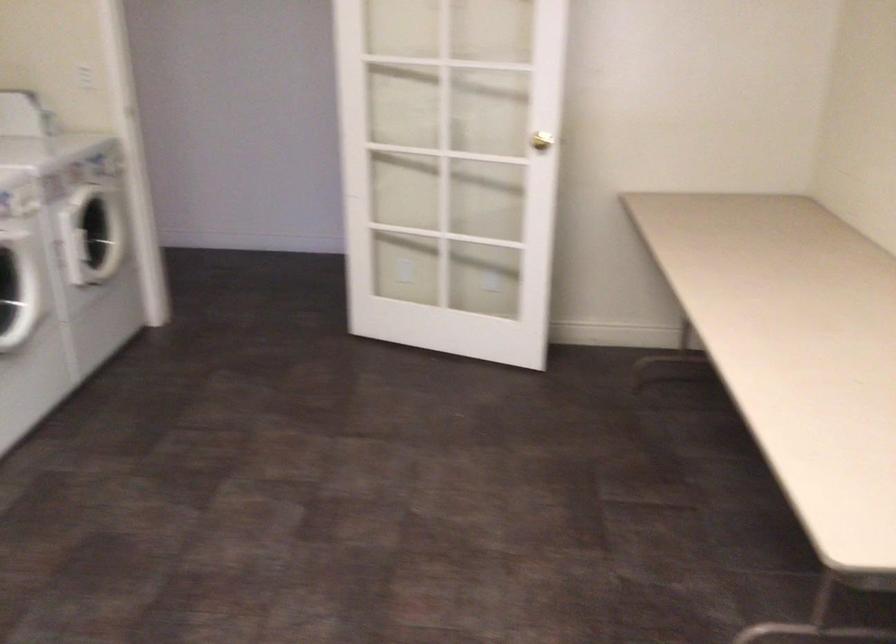
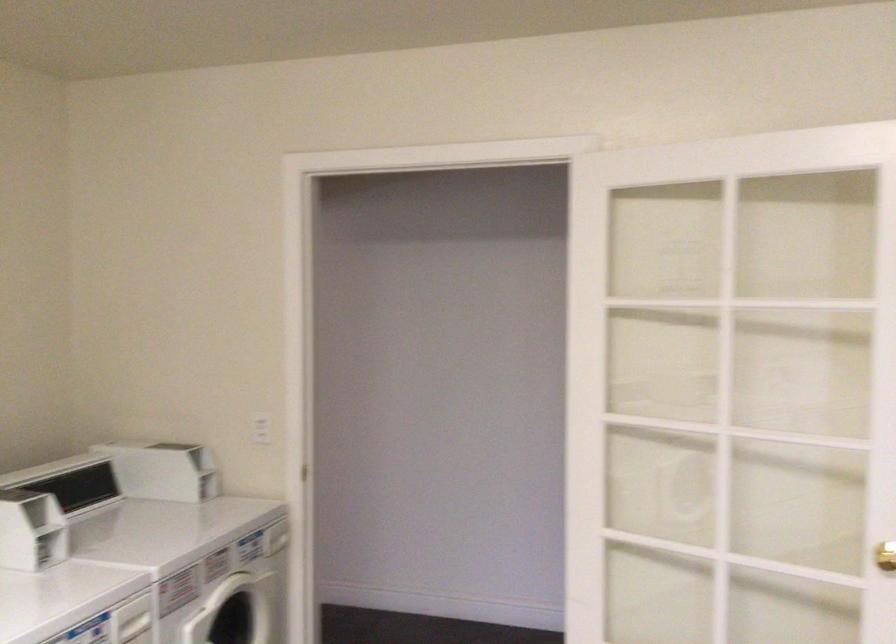
Where in the second image is the point corresponding to the point at 92,73 from the first image?

(261, 428)